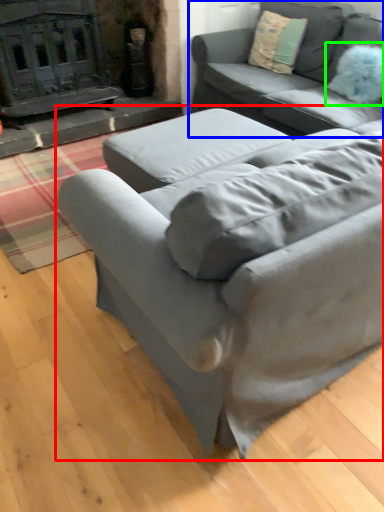
Question: Estimate the real-world distances between objects in this image. Which object is closer to studio couch (highlighted by a red box), studio couch (highlighted by a blue box) or pillow (highlighted by a green box)?

Choices:
 (A) studio couch
 (B) pillow

Answer: (A)